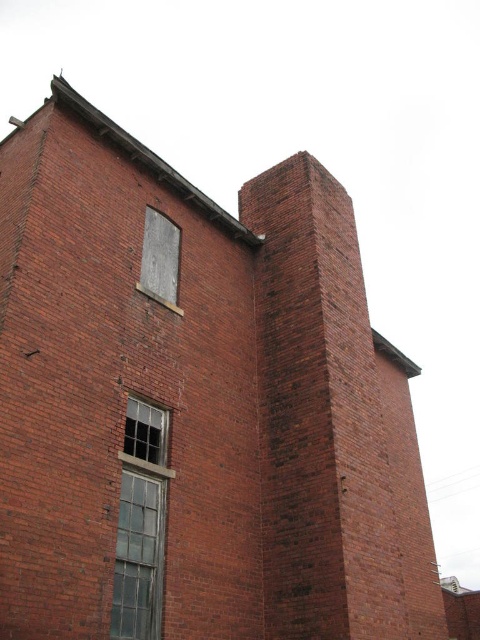
Question: Can you confirm if clear glass window at center is bigger than gray concrete window at upper center?

Choices:
 (A) yes
 (B) no

Answer: (A)

Question: Does clear glass window at center appear over gray concrete window at upper center?

Choices:
 (A) yes
 (B) no

Answer: (B)

Question: Which point is farther to the camera?

Choices:
 (A) gray concrete window at upper center
 (B) clear glass window at center

Answer: (A)

Question: Where is clear glass window at center located in relation to gray concrete window at upper center in the image?

Choices:
 (A) left
 (B) right

Answer: (B)

Question: Which of the following is the closest to the observer?

Choices:
 (A) clear glass window at center
 (B) gray concrete window at upper center

Answer: (A)